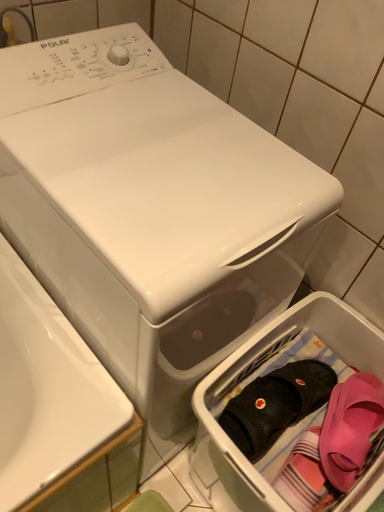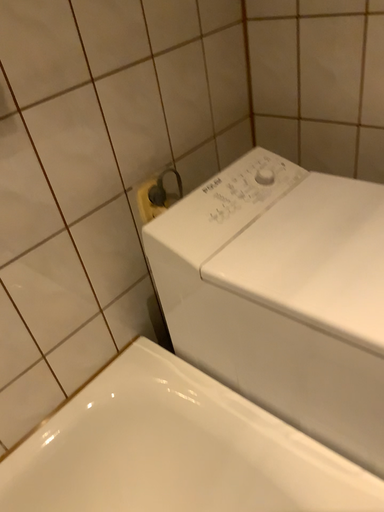
Question: Which way did the camera rotate in the video?

Choices:
 (A) rotated upward
 (B) rotated downward

Answer: (A)